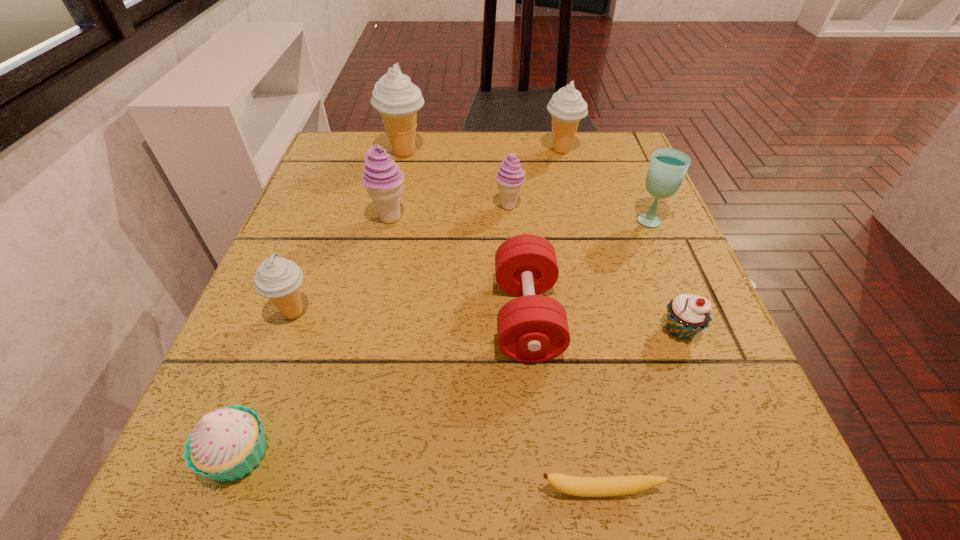
Where is `vacant space located on the front of the smaller purple icecream`? This screenshot has height=540, width=960. vacant space located on the front of the smaller purple icecream is located at coordinates (518, 331).

I want to click on vacant space situated on the right of the leftmost icecream, so click(424, 313).

Image resolution: width=960 pixels, height=540 pixels. What are the coordinates of `free location located 0.170m on the front of the dumbbell` in the screenshot? It's located at (542, 487).

The width and height of the screenshot is (960, 540). What are the coordinates of `free spot located on the left of the farther cupcake` in the screenshot? It's located at (554, 330).

The width and height of the screenshot is (960, 540). Identify the location of free space located 0.050m on the right of the white cupcake. (311, 454).

Find the location of `cupcake situated at the near edge`. cupcake situated at the near edge is located at coordinates (226, 444).

Where is `banana at the near edge`? banana at the near edge is located at coordinates (616, 485).

You are a GUI agent. You are given a task and a screenshot of the screen. Output one action in this format:
    pyautogui.click(x=<x>, y=<y>)
    Task: Click on the cupcake situated at the left edge
    This screenshot has width=960, height=540.
    Given the screenshot: What is the action you would take?
    pyautogui.click(x=226, y=444)

Locate an element on the screen. Image resolution: width=960 pixels, height=540 pixels. icecream present at the right edge is located at coordinates (567, 107).

Find the location of a particular element. glass located in the right edge section of the desktop is located at coordinates (668, 167).